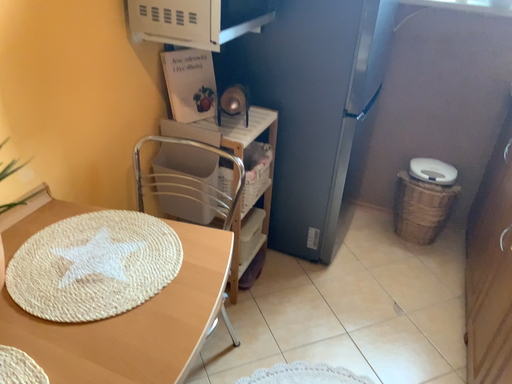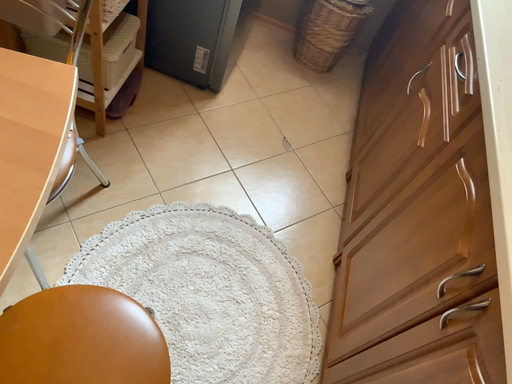
Question: How did the camera likely rotate when shooting the video?

Choices:
 (A) rotated left
 (B) rotated right

Answer: (B)